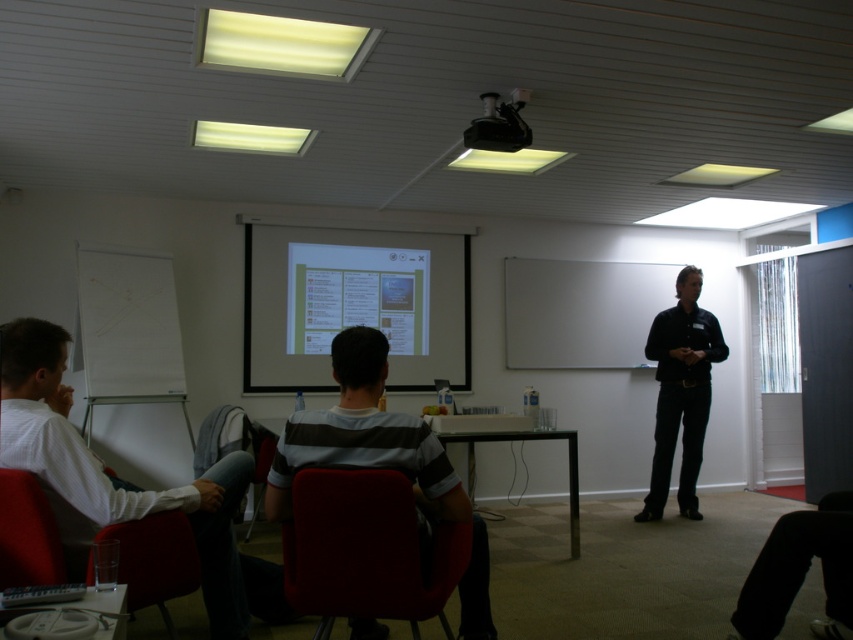
Question: Considering the real-world distances, which object is closest to the matte white projector screen at center?

Choices:
 (A) black plastic projector at upper center
 (B) matte red armchair at lower left
 (C) black smooth shirt at center
 (D) white shirt at left

Answer: (C)

Question: Is the position of black smooth shirt at center more distant than that of matte red armchair at lower left?

Choices:
 (A) yes
 (B) no

Answer: (A)

Question: Which object appears closest to the camera in this image?

Choices:
 (A) velvet red chair at center
 (B) black smooth shirt at center
 (C) striped cotton shirt at center

Answer: (A)

Question: Considering the real-world distances, which object is closest to the velvet red chair at center?

Choices:
 (A) black smooth shirt at center
 (B) black plastic projector at upper center
 (C) white shirt at left

Answer: (C)

Question: Where is velvet red chair at center located in relation to black plastic projector at upper center in the image?

Choices:
 (A) below
 (B) above

Answer: (A)

Question: Does matte white projector screen at center appear on the right side of striped cotton shirt at center?

Choices:
 (A) no
 (B) yes

Answer: (A)